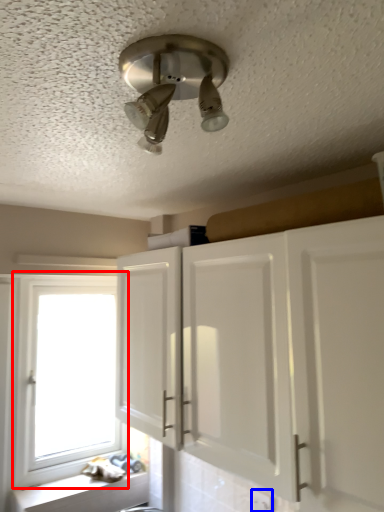
Question: Which point is closer to the camera, window (highlighted by a red box) or electric outlet (highlighted by a blue box)?

Choices:
 (A) window
 (B) electric outlet

Answer: (B)